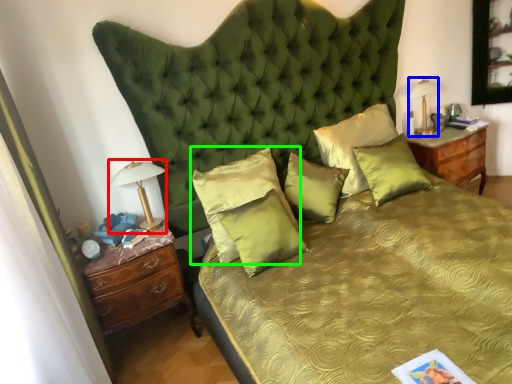
Question: Which is farther away from bedside lamp (highlighted by a red box)? bedside lamp (highlighted by a blue box) or pillow (highlighted by a green box)?

Choices:
 (A) bedside lamp
 (B) pillow

Answer: (A)